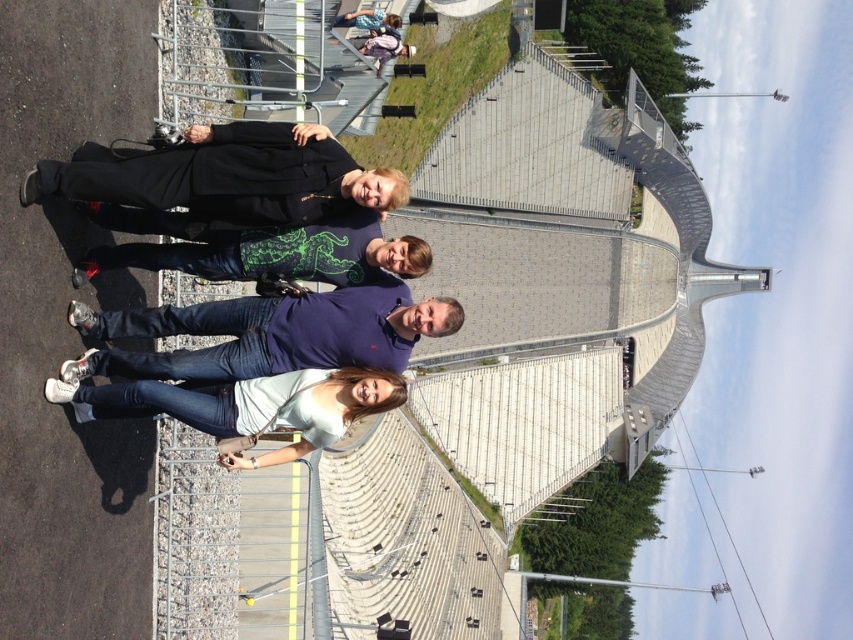
Question: Which of the following is the farthest from the observer?

Choices:
 (A) black matte jacket at upper left
 (B) light blue denim jeans at lower center
 (C) green matte shirt at center

Answer: (C)

Question: Which point appears closest to the camera in this image?

Choices:
 (A) (399, 353)
 (B) (270, 140)

Answer: (B)

Question: From the image, what is the correct spatial relationship of black matte jacket at upper left in relation to green matte shirt at center?

Choices:
 (A) below
 (B) above

Answer: (B)

Question: Can you confirm if black matte jacket at upper left is positioned below green matte shirt at center?

Choices:
 (A) no
 (B) yes

Answer: (A)

Question: Is light blue denim jeans at lower center wider than green matte shirt at center?

Choices:
 (A) no
 (B) yes

Answer: (A)

Question: Which object is closer to the camera taking this photo?

Choices:
 (A) green matte shirt at center
 (B) black matte jacket at upper left
 (C) purple cotton polo shirt at center

Answer: (B)